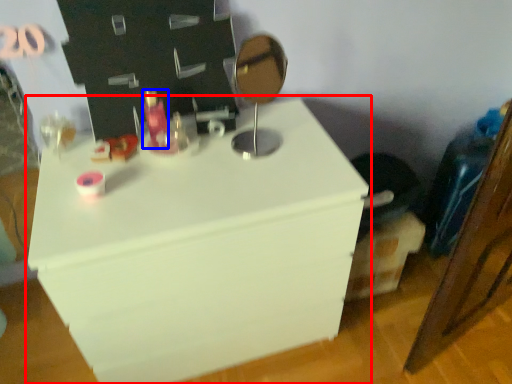
Question: Which object is closer to the camera taking this photo, furniture (highlighted by a red box) or toiletry (highlighted by a blue box)?

Choices:
 (A) furniture
 (B) toiletry

Answer: (A)